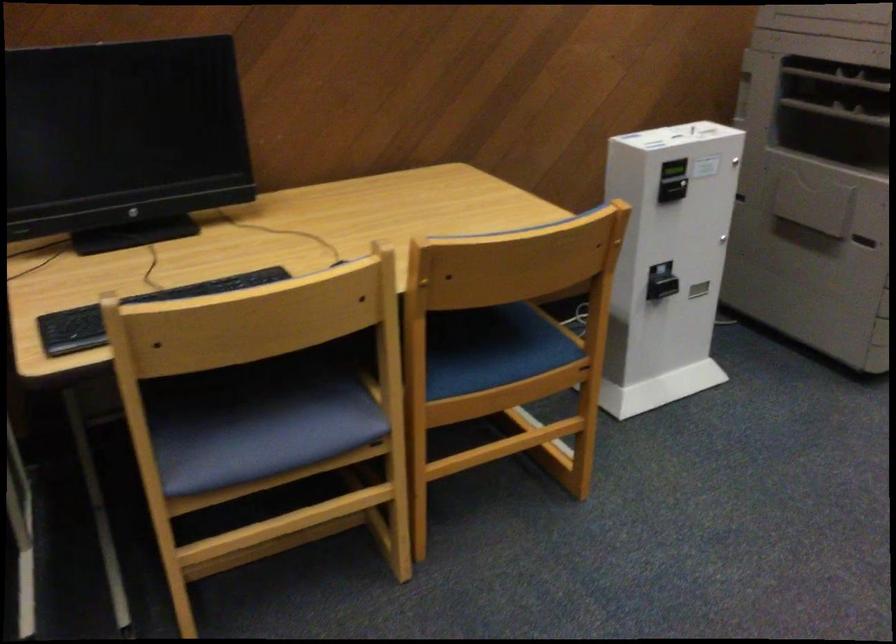
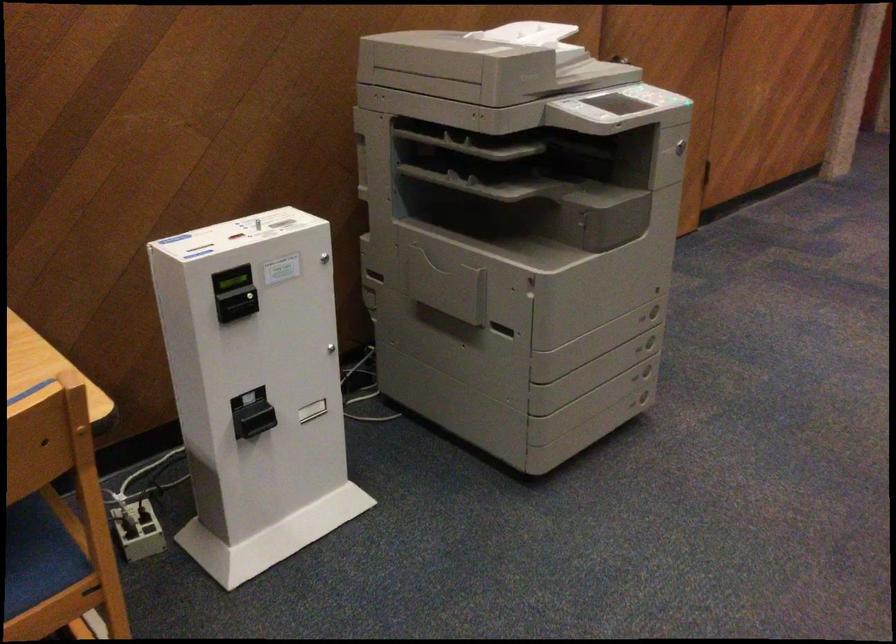
In a continuous first-person perspective shot, in which direction is the camera moving?

The movement direction of the cameraman is right, forward.